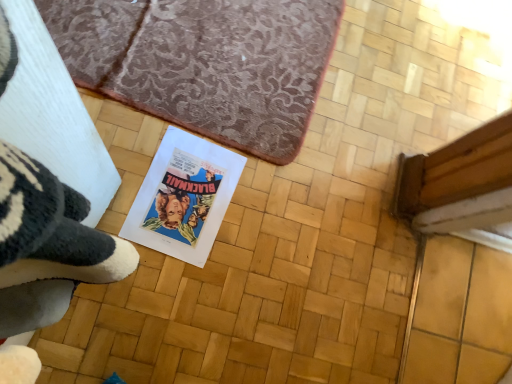
The height and width of the screenshot is (384, 512). I want to click on vacant space to the right of matte paper book at center, so click(254, 263).